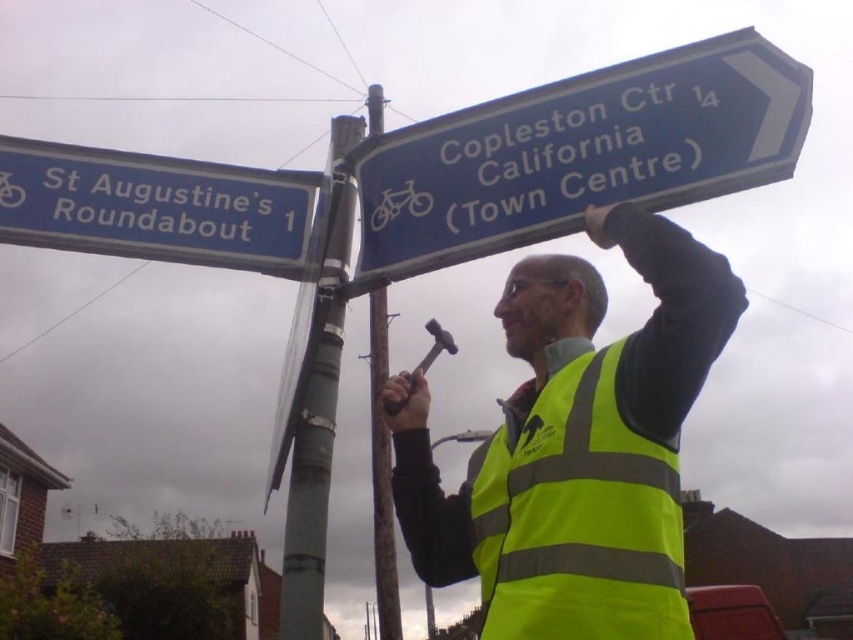
Question: Which is farther from the gray metallic pole at center?

Choices:
 (A) matte silver hammer at center
 (B) yellow reflective vest at upper center

Answer: (B)

Question: Which point is closer to the camera taking this photo?

Choices:
 (A) (618, 179)
 (B) (560, 417)
 (C) (332, 125)
 (D) (251, 168)

Answer: (B)

Question: Does yellow reflective vest at upper center have a smaller size compared to yellow reflective safety vest at center?

Choices:
 (A) no
 (B) yes

Answer: (A)

Question: Which of the following is the closest to the observer?

Choices:
 (A) (547, 477)
 (B) (524, 588)

Answer: (B)

Question: Observing the image, what is the correct spatial positioning of blue plastic sign at upper left in reference to matte silver hammer at center?

Choices:
 (A) left
 (B) right

Answer: (A)

Question: Is blue plastic sign at upper right in front of matte silver hammer at center?

Choices:
 (A) yes
 (B) no

Answer: (A)